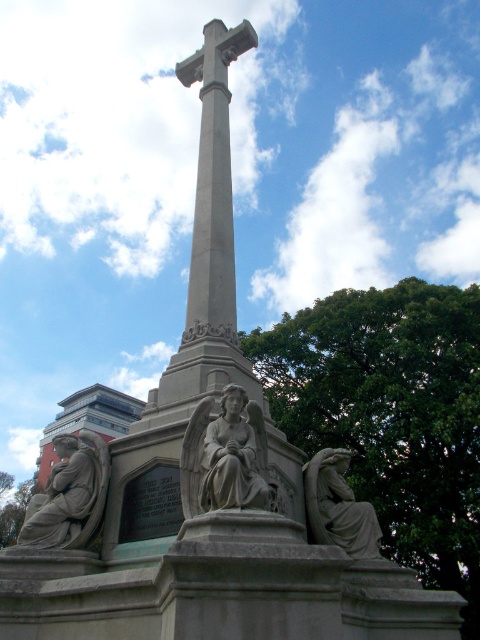
You are standing in front of the monument and want to touch both the matte gray statue at center and the gray stone angel at lower right. Which one would you need to walk forward towards first?

The matte gray statue at center is closer to the viewer than the gray stone angel at lower right, so you would need to first touch the matte gray statue at center before walking further to reach the gray stone angel at lower right.

You are standing in front of the monument and want to take a photo of the gray stone cross at center without the stone statue at lower left appearing in the frame. Which direction should you move to ensure the statue is out of the shot?

Move to the right side of the gray stone cross at center so that the stone statue at lower left is no longer visible in the frame.

You are an art student analyzing the monument. You observe the matte gray statue at center and the gray stone angel at lower right. Which of these two objects is taller?

The gray stone angel at lower right is taller than the matte gray statue at center.